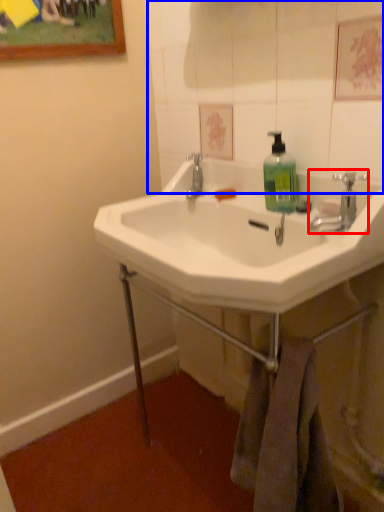
Question: Which object is further to the camera taking this photo, tap (highlighted by a red box) or mirror (highlighted by a blue box)?

Choices:
 (A) tap
 (B) mirror

Answer: (A)